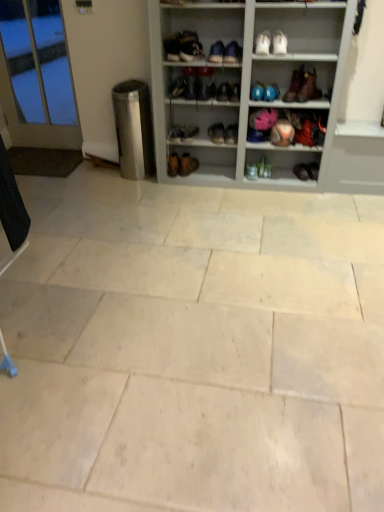
Locate an element on the screen. vacant area that is in front of matte black shoe at center, the tenth footwear from the left is located at coordinates (312, 184).